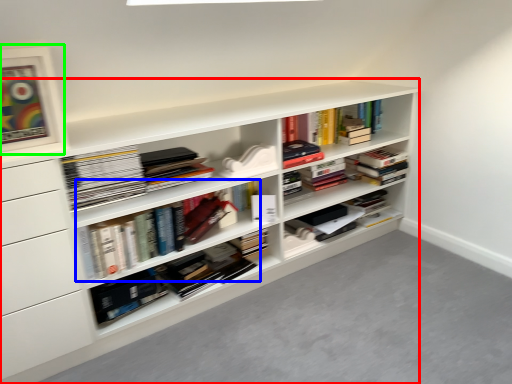
Question: Which object is positioned farthest from shelf (highlighted by a red box)? Select from book (highlighted by a blue box) and picture frame (highlighted by a green box).

Choices:
 (A) book
 (B) picture frame

Answer: (B)